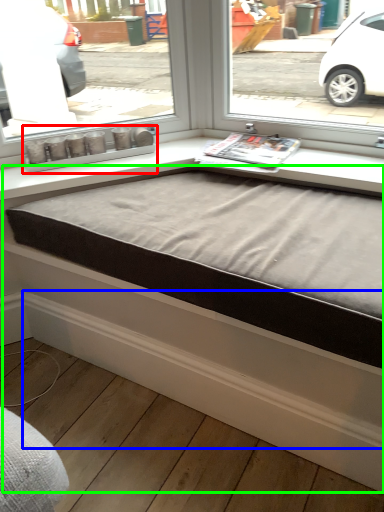
Question: Which is nearer to the window box (highlighted by a red box)? curb (highlighted by a blue box) or bed frame (highlighted by a green box).

Choices:
 (A) curb
 (B) bed frame

Answer: (B)